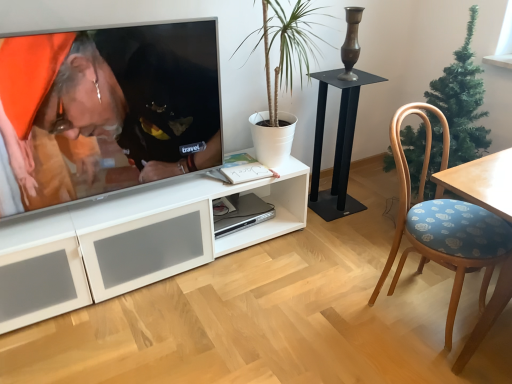
Question: Can you confirm if wooden chair with blue floral cushion at right is thinner than white matte plant at center?

Choices:
 (A) yes
 (B) no

Answer: (B)

Question: Is wooden chair with blue floral cushion at right not close to white matte plant at center?

Choices:
 (A) yes
 (B) no

Answer: (B)

Question: Does wooden chair with blue floral cushion at right lie behind white matte plant at center?

Choices:
 (A) no
 (B) yes

Answer: (A)

Question: Is wooden chair with blue floral cushion at right at the right side of white matte plant at center?

Choices:
 (A) yes
 (B) no

Answer: (A)

Question: From a real-world perspective, does wooden chair with blue floral cushion at right sit lower than white matte plant at center?

Choices:
 (A) yes
 (B) no

Answer: (A)

Question: Can you confirm if wooden chair with blue floral cushion at right is shorter than white matte plant at center?

Choices:
 (A) no
 (B) yes

Answer: (A)

Question: Is sleek silver computer at center thinner than matte black shirt at upper left?

Choices:
 (A) no
 (B) yes

Answer: (A)

Question: Is the position of sleek silver computer at center less distant than that of matte black shirt at upper left?

Choices:
 (A) yes
 (B) no

Answer: (B)

Question: From a real-world perspective, is sleek silver computer at center positioned under matte black shirt at upper left based on gravity?

Choices:
 (A) no
 (B) yes

Answer: (B)

Question: Is sleek silver computer at center at the left side of matte black shirt at upper left?

Choices:
 (A) no
 (B) yes

Answer: (A)

Question: Can matte black shirt at upper left be found inside sleek silver computer at center?

Choices:
 (A) no
 (B) yes

Answer: (A)

Question: Is sleek silver computer at center next to matte black shirt at upper left and touching it?

Choices:
 (A) no
 (B) yes

Answer: (A)

Question: Does black metal table at center have a greater height compared to wooden chair with blue floral cushion at right?

Choices:
 (A) yes
 (B) no

Answer: (B)